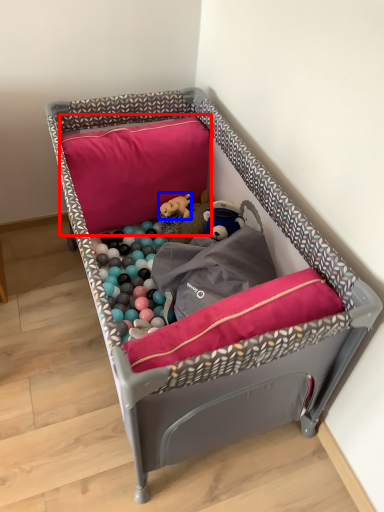
Question: Which object is closer to the camera taking this photo, pillow (highlighted by a red box) or toy (highlighted by a blue box)?

Choices:
 (A) pillow
 (B) toy

Answer: (A)